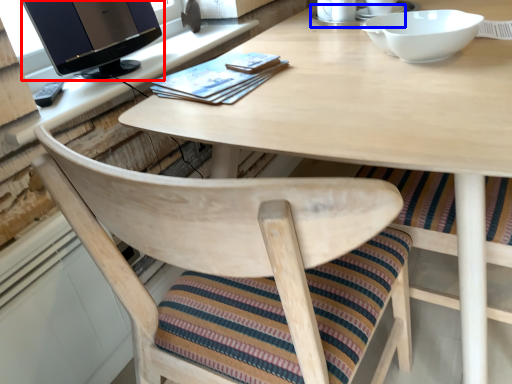
Question: Which of the following is the farthest to the observer, computer monitor (highlighted by a red box) or saucer (highlighted by a blue box)?

Choices:
 (A) computer monitor
 (B) saucer

Answer: (B)